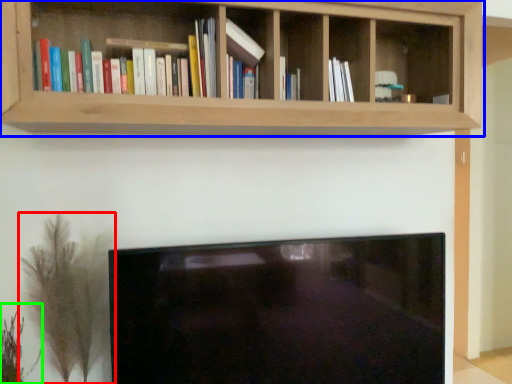
Question: Considering the real-world distances, which object is farthest from plant (highlighted by a red box)? shelf (highlighted by a blue box) or plant (highlighted by a green box)?

Choices:
 (A) shelf
 (B) plant

Answer: (A)